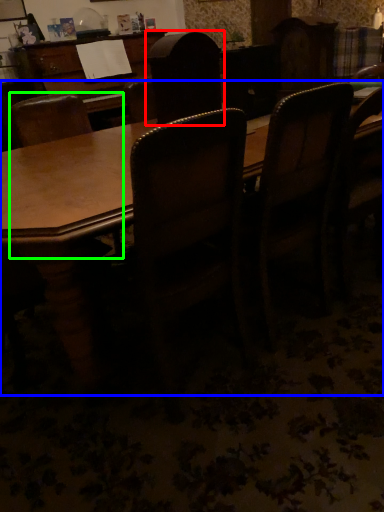
Question: Which object is positioned closest to chair (highlighted by a red box)? Select from table (highlighted by a blue box) and chair (highlighted by a green box).

Choices:
 (A) table
 (B) chair

Answer: (A)